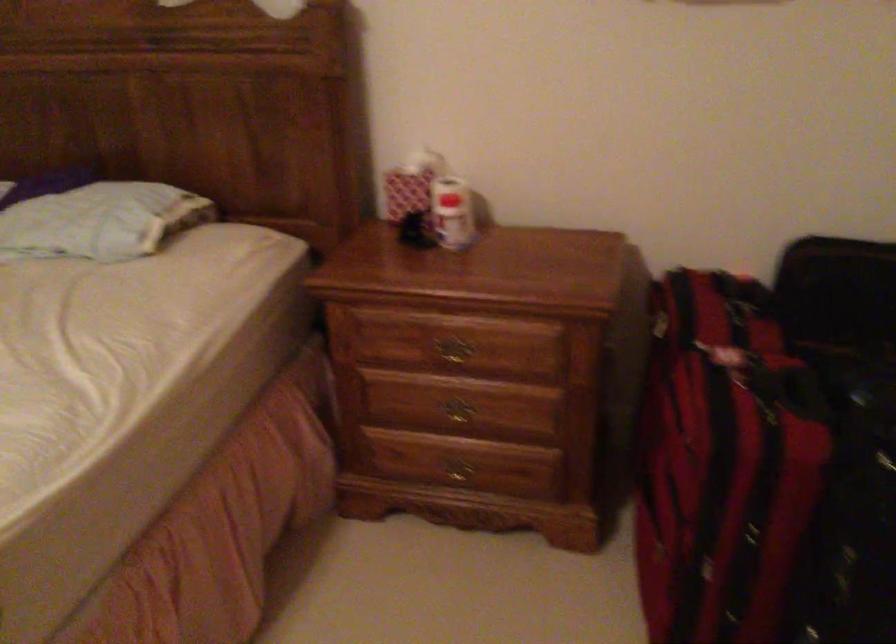
The image size is (896, 644). What are the coordinates of `white and red can` in the screenshot? It's located at (452, 213).